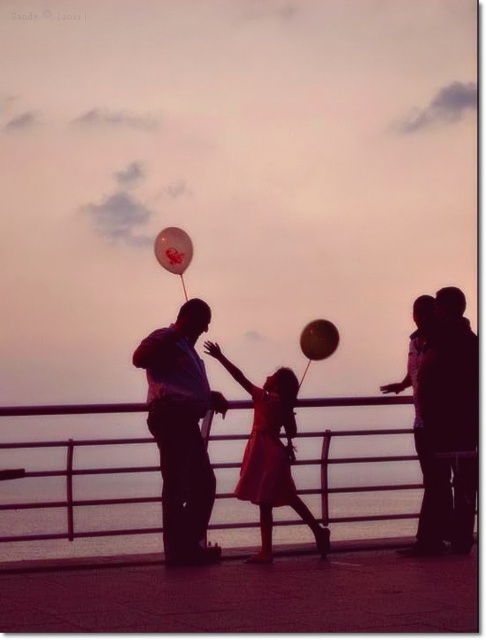
Is matte black shirt at center to the left of matte red dress at center from the viewer's perspective?

Indeed, matte black shirt at center is positioned on the left side of matte red dress at center.

The image size is (486, 640). What do you see at coordinates (181, 432) in the screenshot?
I see `matte black shirt at center` at bounding box center [181, 432].

The width and height of the screenshot is (486, 640). I want to click on matte black shirt at center, so click(x=181, y=432).

Is matte black dress at center above silhouette couple at right?

Yes.

Describe the element at coordinates (445, 420) in the screenshot. I see `matte black dress at center` at that location.

You are a GUI agent. You are given a task and a screenshot of the screen. Output one action in this format:
    pyautogui.click(x=<x>, y=<y>)
    Task: Click on the matte black dress at center
    The image size is (486, 640).
    Given the screenshot: What is the action you would take?
    445,420

Is matte black shirt at center to the left of translucent plastic balloon at center from the viewer's perspective?

Indeed, matte black shirt at center is positioned on the left side of translucent plastic balloon at center.

Which is in front, point (186, 452) or point (316, 320)?

Point (186, 452) is in front.

Identify the location of matte black shirt at center. (181, 432).